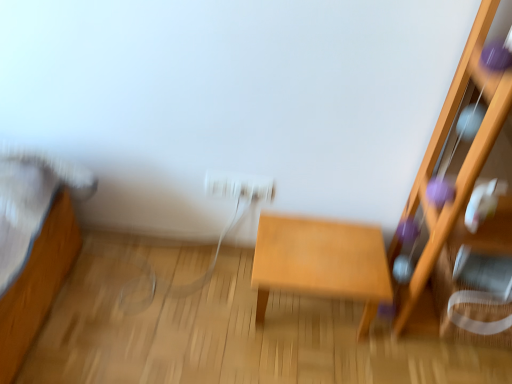
You are a GUI agent. You are given a task and a screenshot of the screen. Output one action in this format:
    pyautogui.click(x=<x>, y=<y>)
    Task: Click on the light brown wooden table at center
    This screenshot has height=384, width=512.
    Given the screenshot: What is the action you would take?
    pyautogui.click(x=321, y=262)

Describe the element at coordinates (321, 262) in the screenshot. I see `light brown wooden table at center` at that location.

Locate an element on the screen. This screenshot has height=384, width=512. wooden shelf at right is located at coordinates (465, 167).

Looking at this image, considering the sizes of objects wooden shelf at right and white glossy electric outlet at center in the image provided, who is shorter, wooden shelf at right or white glossy electric outlet at center?

With less height is white glossy electric outlet at center.

Can white glossy electric outlet at center be found inside wooden shelf at right?

Actually, white glossy electric outlet at center is outside wooden shelf at right.

Considering the positions of objects wooden shelf at right and white glossy electric outlet at center in the image provided, who is more to the left, wooden shelf at right or white glossy electric outlet at center?

white glossy electric outlet at center.

Which object is further away from the camera taking this photo, wooden shelf at right or white glossy electric outlet at center?

white glossy electric outlet at center is behind.

Relative to wooden shelf at right, is light brown wooden table at center in front or behind?

Visually, light brown wooden table at center is located behind wooden shelf at right.

Considering the points (282, 267) and (507, 161), which point is in front, point (282, 267) or point (507, 161)?

Point (507, 161)

This screenshot has width=512, height=384. I want to click on furniture above the light brown wooden table at center (from a real-world perspective), so click(x=465, y=167).

Considering the sizes of objects light brown wooden table at center and wooden shelf at right in the image provided, who is taller, light brown wooden table at center or wooden shelf at right?

With more height is wooden shelf at right.

Does wooden shelf at right appear on the right side of light brown wooden table at center?

Yes.

Considering their positions, is wooden shelf at right located in front of or behind light brown wooden table at center?

In the image, wooden shelf at right appears in front of light brown wooden table at center.

Can you confirm if wooden shelf at right is smaller than light brown wooden table at center?

Actually, wooden shelf at right might be larger than light brown wooden table at center.

Would you say wooden shelf at right is a long distance from light brown wooden table at center?

No, wooden shelf at right is in close proximity to light brown wooden table at center.

Is white glossy electric outlet at center facing towards wooden shelf at right?

Yes, white glossy electric outlet at center is facing wooden shelf at right.

From a real-world perspective, is white glossy electric outlet at center physically located above or below wooden shelf at right?

From a real-world perspective, white glossy electric outlet at center is physically below wooden shelf at right.

From the image's perspective, who appears lower, white glossy electric outlet at center or wooden shelf at right?

wooden shelf at right appears lower in the image.

At what (x,y) coordinates should I click in order to perform the action: click on furniture on the right of white glossy electric outlet at center. Please return your answer as a coordinate pair (x, y). Looking at the image, I should click on (465, 167).

Does white glossy electric outlet at center have a smaller size compared to light brown wooden table at center?

Indeed, white glossy electric outlet at center has a smaller size compared to light brown wooden table at center.

The image size is (512, 384). Identify the location of table that is in front of the white glossy electric outlet at center. (321, 262).

How different are the orientations of white glossy electric outlet at center and light brown wooden table at center in degrees?

89 degrees.

How much distance is there between white glossy electric outlet at center and light brown wooden table at center?

Result: white glossy electric outlet at center is 10.54 inches from light brown wooden table at center.

In the image, is light brown wooden table at center positioned in front of or behind white glossy electric outlet at center?

Clearly, light brown wooden table at center is in front of white glossy electric outlet at center.

Considering the sizes of objects light brown wooden table at center and white glossy electric outlet at center in the image provided, who is shorter, light brown wooden table at center or white glossy electric outlet at center?

white glossy electric outlet at center is shorter.

Find the location of `electric outlet located underneath the wooden shelf at right (from a real-world perspective)`. electric outlet located underneath the wooden shelf at right (from a real-world perspective) is located at coordinates (240, 186).

Find the location of `furniture that is in front of the light brown wooden table at center`. furniture that is in front of the light brown wooden table at center is located at coordinates (465, 167).

Consider the image. From the image, which object appears to be nearer to wooden shelf at right, light brown wooden table at center or white glossy electric outlet at center?

light brown wooden table at center.

Looking at the image, which one is located closer to light brown wooden table at center, wooden shelf at right or white glossy electric outlet at center?

Among the two, white glossy electric outlet at center is located nearer to light brown wooden table at center.

Which object lies nearer to the anchor point light brown wooden table at center, white glossy electric outlet at center or wooden shelf at right?

white glossy electric outlet at center is closer to light brown wooden table at center.

Looking at the image, which one is located closer to white glossy electric outlet at center, wooden shelf at right or light brown wooden table at center?

light brown wooden table at center is positioned closer to the anchor white glossy electric outlet at center.

Estimate the real-world distances between objects in this image. Which object is closer to wooden shelf at right, white glossy electric outlet at center or light brown wooden table at center?

light brown wooden table at center is closer to wooden shelf at right.

Consider the image. Considering their positions, is light brown wooden table at center positioned closer to white glossy electric outlet at center than wooden shelf at right?

light brown wooden table at center is positioned closer to the anchor white glossy electric outlet at center.

This screenshot has height=384, width=512. I want to click on table situated between white glossy electric outlet at center and wooden shelf at right from left to right, so click(x=321, y=262).